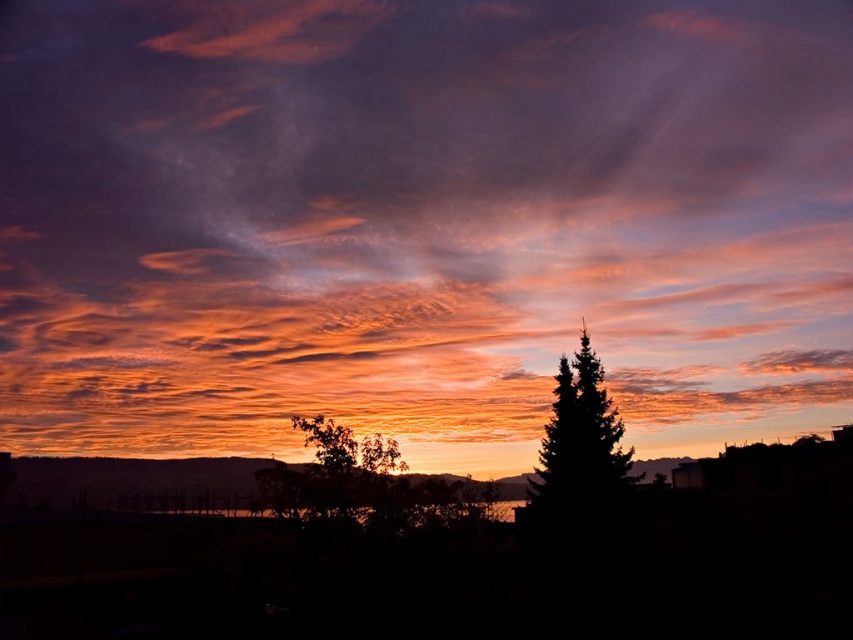
You are an artist trying to paint the sunset scene. You notice the orange translucent cloud at center and the green leafy tree at center. Which object should you paint first if you want to ensure proper layering based on their height?

The orange translucent cloud at center is much taller than the green leafy tree at center, so you should paint the green leafy tree at center first to ensure proper layering.

You are standing in the field where the sunset is happening. You want to take a photo of both the silhouette fir tree at right and the green leafy tree at center. If your camera can capture a maximum distance of 30 feet between the closest and farthest objects in focus, will both trees be in focus?

The silhouette fir tree at right is 27.13 feet away from the green leafy tree at center. Since the distance between them is less than 30 feet, both trees will be in focus within the camera range.